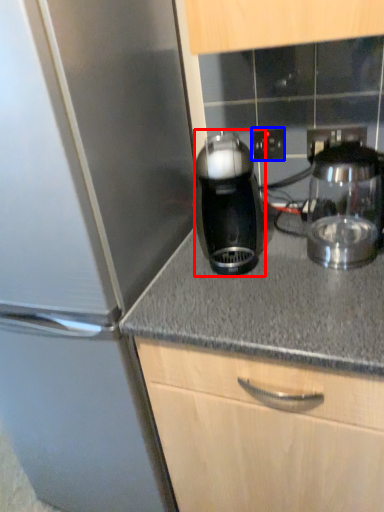
Question: Which of the following is the farthest to the observer, kitchen appliance (highlighted by a red box) or electric outlet (highlighted by a blue box)?

Choices:
 (A) kitchen appliance
 (B) electric outlet

Answer: (B)